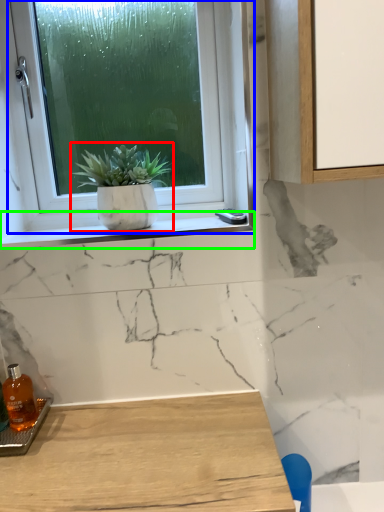
Question: Which object is positioned closest to houseplant (highlighted by a red box)? Select from window (highlighted by a blue box) and window sill (highlighted by a green box).

Choices:
 (A) window
 (B) window sill

Answer: (B)